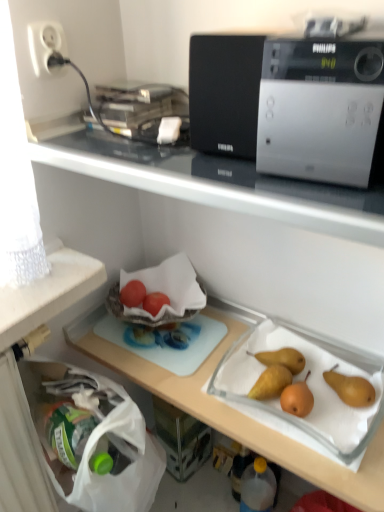
The image size is (384, 512). What are the coordinates of `vacant area that lies to the right of matte red tomato at center-left, the 2th fruit from the right` in the screenshot? It's located at (193, 331).